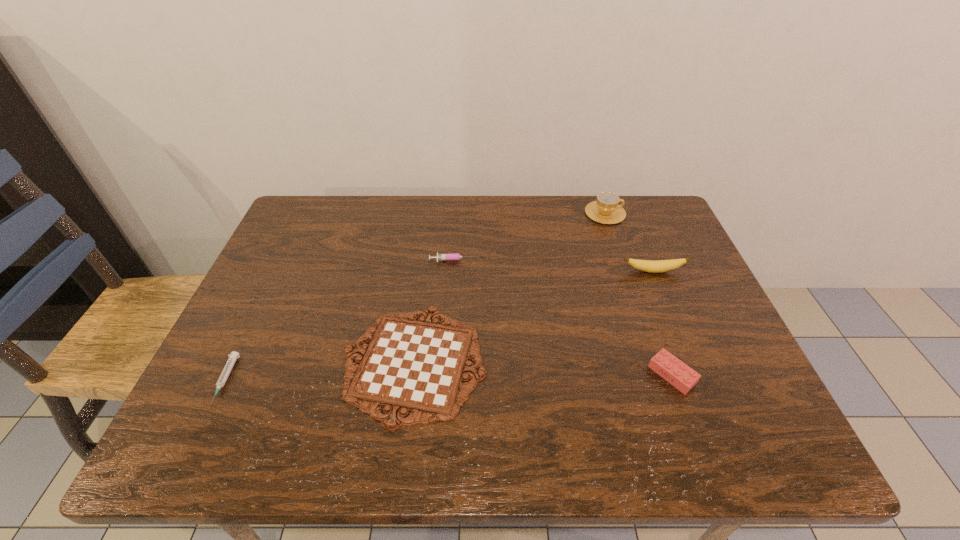
Identify the location of vacant region located 0.310m on the back of the fifth shortest object. (625, 202).

Identify the location of free location located on the back of the Lego. The height and width of the screenshot is (540, 960). (636, 279).

Locate an element on the screen. The image size is (960, 540). vacant region located 0.160m on the back of the taller syringe is located at coordinates (457, 222).

Where is `free region located on the back of the chessboard`? free region located on the back of the chessboard is located at coordinates (426, 268).

At what (x,y) coordinates should I click in order to perform the action: click on object that is positioned at the far edge. Please return your answer as a coordinate pair (x, y). Looking at the image, I should click on (606, 210).

At what (x,y) coordinates should I click in order to perform the action: click on object at the near edge. Please return your answer as a coordinate pair (x, y). Looking at the image, I should click on (418, 366).

Where is `object present at the left edge`? The height and width of the screenshot is (540, 960). object present at the left edge is located at coordinates (233, 356).

You are a GUI agent. You are given a task and a screenshot of the screen. Output one action in this format:
    pyautogui.click(x=<x>, y=<y>)
    Task: Click on the cup located at the right edge
    
    Given the screenshot: What is the action you would take?
    pyautogui.click(x=606, y=210)

Image resolution: width=960 pixels, height=540 pixels. In order to click on banana that is at the right edge in this screenshot , I will do `click(653, 266)`.

The image size is (960, 540). I want to click on Lego that is at the right edge, so click(681, 376).